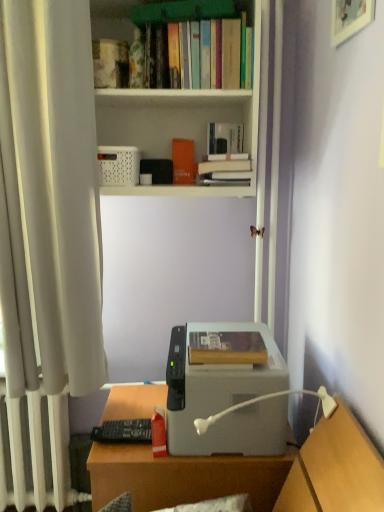
Question: Is white plastic lamp at lower center thinner than white plastic bookcase at upper center?

Choices:
 (A) no
 (B) yes

Answer: (A)

Question: From the image's perspective, is white plastic lamp at lower center over white plastic bookcase at upper center?

Choices:
 (A) yes
 (B) no

Answer: (B)

Question: Is white plastic lamp at lower center positioned beyond the bounds of white plastic bookcase at upper center?

Choices:
 (A) no
 (B) yes

Answer: (B)

Question: Is white plastic lamp at lower center taller than white plastic bookcase at upper center?

Choices:
 (A) no
 (B) yes

Answer: (A)

Question: Could you tell me if white plastic lamp at lower center is turned towards white plastic bookcase at upper center?

Choices:
 (A) yes
 (B) no

Answer: (B)

Question: Does white plastic lamp at lower center have a greater width compared to white plastic bookcase at upper center?

Choices:
 (A) no
 (B) yes

Answer: (B)

Question: Considering the relative sizes of hardcover book at upper center, which ranks as the 1th book in back-to-front order, and gray matte printer at center in the image provided, is hardcover book at upper center, which ranks as the 1th book in back-to-front order, smaller than gray matte printer at center?

Choices:
 (A) yes
 (B) no

Answer: (A)

Question: From the image's perspective, would you say hardcover book at upper center, which is counted as the third book, starting from the front, is shown under gray matte printer at center?

Choices:
 (A) yes
 (B) no

Answer: (B)

Question: Is hardcover book at upper center, which ranks as the 1th book in back-to-front order, at the left side of gray matte printer at center?

Choices:
 (A) no
 (B) yes

Answer: (A)

Question: Is hardcover book at upper center, which is counted as the second book, starting from the top, next to gray matte printer at center?

Choices:
 (A) no
 (B) yes

Answer: (A)

Question: Does hardcover book at upper center, which ranks as the 1th book in back-to-front order, turn towards gray matte printer at center?

Choices:
 (A) no
 (B) yes

Answer: (A)

Question: From a real-world perspective, is hardcover book at upper center, the second book from the bottom, positioned over gray matte printer at center based on gravity?

Choices:
 (A) no
 (B) yes

Answer: (B)

Question: Is the position of hardcover book at center, which is the 3th book in top-to-bottom order, more distant than that of hardcover book at upper center, which is counted as the second book, starting from the top?

Choices:
 (A) no
 (B) yes

Answer: (A)